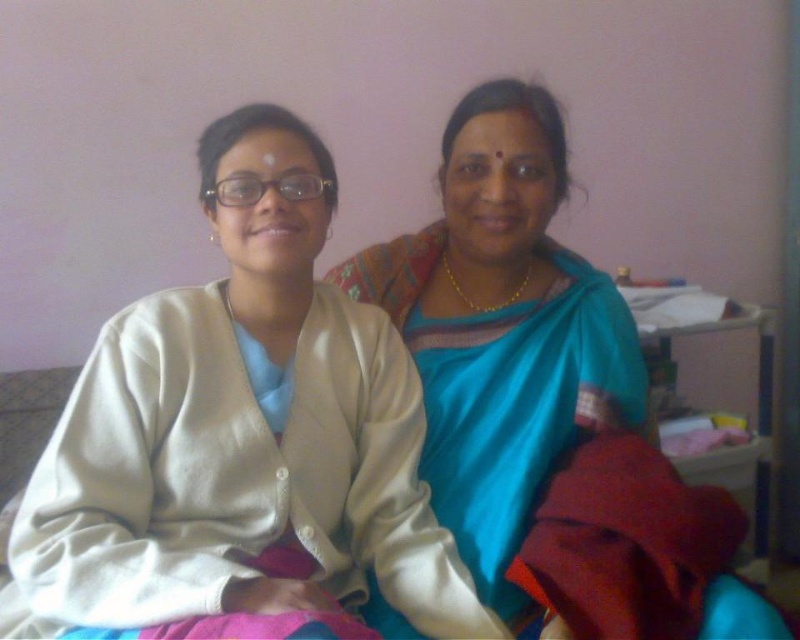
What do you see at coordinates (240, 442) in the screenshot?
I see `silky blue saree at center` at bounding box center [240, 442].

Who is lower down, silky blue saree at center or silky blue sari at center?

silky blue saree at center

Does point (60, 584) come closer to viewer compared to point (586, 320)?

Yes, it is.

The width and height of the screenshot is (800, 640). What are the coordinates of `silky blue saree at center` in the screenshot? It's located at (240, 442).